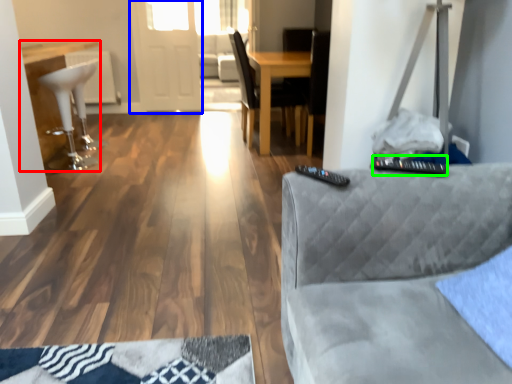
Question: Based on their relative distances, which object is nearer to table (highlighted by a red box)? Choose from glass door (highlighted by a blue box) and control (highlighted by a green box).

Choices:
 (A) glass door
 (B) control

Answer: (A)